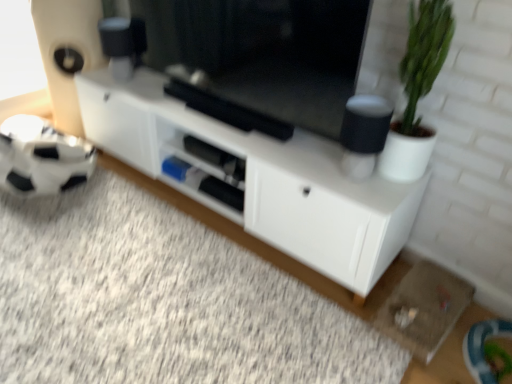
Question: From the image's perspective, is white matte cabinet at center below green matte plant at right?

Choices:
 (A) yes
 (B) no

Answer: (A)

Question: Considering the relative sizes of white matte cabinet at center and green matte plant at right in the image provided, is white matte cabinet at center bigger than green matte plant at right?

Choices:
 (A) no
 (B) yes

Answer: (B)

Question: Is green matte plant at right surrounded by white matte cabinet at center?

Choices:
 (A) no
 (B) yes

Answer: (A)

Question: Is white matte cabinet at center not inside green matte plant at right?

Choices:
 (A) no
 (B) yes

Answer: (B)

Question: Does white matte cabinet at center have a lesser width compared to green matte plant at right?

Choices:
 (A) no
 (B) yes

Answer: (A)

Question: In terms of size, does black matte tv at center appear bigger or smaller than white matte cabinet at center?

Choices:
 (A) small
 (B) big

Answer: (A)

Question: Is black matte tv at center inside the boundaries of white matte cabinet at center, or outside?

Choices:
 (A) outside
 (B) inside

Answer: (A)

Question: Based on their positions, is black matte tv at center located to the left or right of white matte cabinet at center?

Choices:
 (A) right
 (B) left

Answer: (A)

Question: Considering the positions of point (351, 16) and point (426, 173), is point (351, 16) closer or farther from the camera than point (426, 173)?

Choices:
 (A) closer
 (B) farther

Answer: (A)

Question: Is black matte tv at center taller or shorter than green matte plant at right?

Choices:
 (A) tall
 (B) short

Answer: (B)

Question: Is point (300, 46) positioned closer to the camera than point (416, 160)?

Choices:
 (A) farther
 (B) closer

Answer: (A)

Question: Would you say black matte tv at center is inside or outside green matte plant at right?

Choices:
 (A) inside
 (B) outside

Answer: (B)

Question: In the image, is black matte tv at center positioned in front of or behind green matte plant at right?

Choices:
 (A) front
 (B) behind

Answer: (B)

Question: Is white matte cabinet at center bigger or smaller than green matte plant at right?

Choices:
 (A) small
 (B) big

Answer: (B)

Question: Is white matte cabinet at center situated inside green matte plant at right or outside?

Choices:
 (A) inside
 (B) outside

Answer: (B)